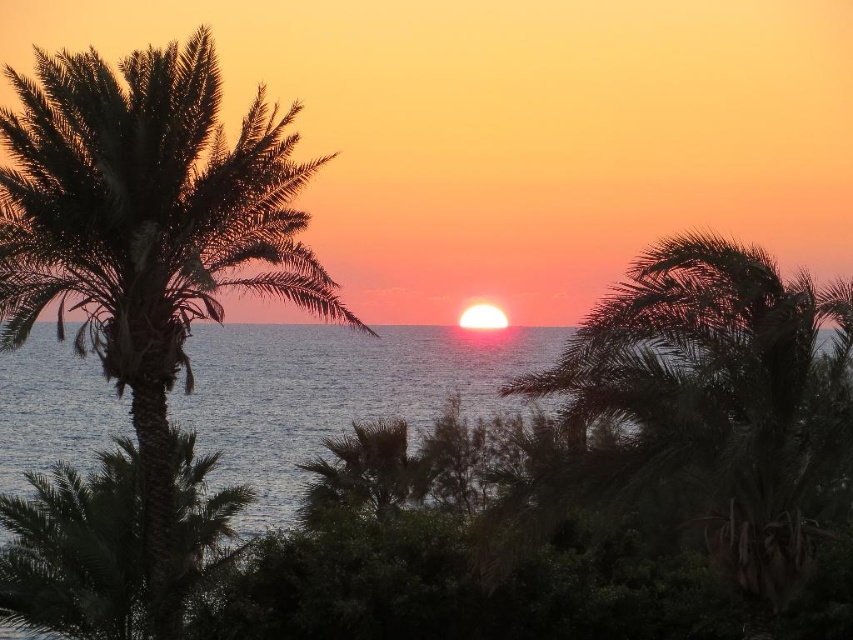
Question: Can you confirm if green leafy palm tree at center is positioned below blue water at center?

Choices:
 (A) no
 (B) yes

Answer: (A)

Question: Among these objects, which one is nearest to the camera?

Choices:
 (A) green leafy palm tree at left
 (B) silhouette leafy palm at left
 (C) green leafy palm tree at center
 (D) blue water at center

Answer: (C)

Question: Considering the real-world distances, which object is closest to the green leafy palm tree at center?

Choices:
 (A) blue water at center
 (B) green leafy palm tree at left

Answer: (B)

Question: Is silhouette leafy palm at left smaller than green leafy palm tree at left?

Choices:
 (A) yes
 (B) no

Answer: (A)

Question: From the image, what is the correct spatial relationship of green leafy palm tree at center in relation to blue water at center?

Choices:
 (A) below
 (B) above

Answer: (B)

Question: Which point is closer to the camera taking this photo?

Choices:
 (A) (57, 582)
 (B) (456, 353)

Answer: (A)